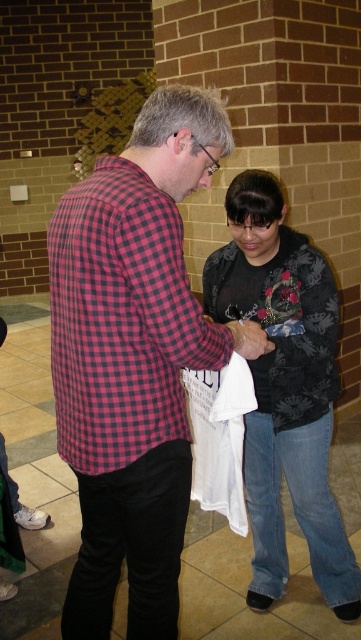
Who is more distant from viewer, (154, 186) or (267, 205)?

The point (267, 205) is behind.

The image size is (361, 640). In order to click on plaid fabric shirt at left in this screenshot , I will do `click(122, 320)`.

Does plaid shirt at center appear under dark floral sweater at center?

Actually, plaid shirt at center is above dark floral sweater at center.

Is point (80, 500) farther from viewer compared to point (275, 433)?

No, it is in front of (275, 433).

Where is `plaid shirt at center`? This screenshot has height=640, width=361. plaid shirt at center is located at coordinates (133, 358).

Between plaid shirt at center and plaid fabric shirt at left, which one is positioned higher?

Positioned higher is plaid fabric shirt at left.

Is plaid shirt at center bigger than plaid fabric shirt at left?

Yes.

Does point (96, 500) come farther from viewer compared to point (110, 205)?

That is True.

Locate an element on the screen. This screenshot has height=640, width=361. plaid shirt at center is located at coordinates (133, 358).